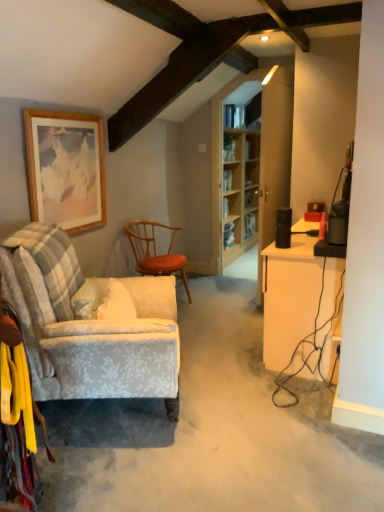
Question: Can you confirm if light blue fabric armchair at left, which ranks as the 1th chair in front-to-back order, is shorter than wooden textured chair at center, which appears as the second chair when viewed from the front?

Choices:
 (A) no
 (B) yes

Answer: (A)

Question: Does light blue fabric armchair at left, which ranks as the 1th chair in front-to-back order, lie in front of wooden textured chair at center, which appears as the second chair when viewed from the front?

Choices:
 (A) yes
 (B) no

Answer: (A)

Question: Is light blue fabric armchair at left, which ranks as the 1th chair in front-to-back order, thinner than wooden textured chair at center, which appears as the second chair when viewed from the front?

Choices:
 (A) no
 (B) yes

Answer: (A)

Question: Is wooden textured chair at center, the 1th chair when ordered from back to front, surrounded by light blue fabric armchair at left, which is the second chair in back-to-front order?

Choices:
 (A) no
 (B) yes

Answer: (A)

Question: From a real-world perspective, is light blue fabric armchair at left, which ranks as the 1th chair in front-to-back order, beneath wooden textured chair at center, which appears as the second chair when viewed from the front?

Choices:
 (A) no
 (B) yes

Answer: (A)

Question: Does point (160, 254) appear closer or farther from the camera than point (130, 290)?

Choices:
 (A) closer
 (B) farther

Answer: (B)

Question: Considering the positions of wooden textured chair at center, the 1th chair when ordered from back to front, and light blue fabric armchair at left, which ranks as the 1th chair in front-to-back order, in the image, is wooden textured chair at center, the 1th chair when ordered from back to front, bigger or smaller than light blue fabric armchair at left, which ranks as the 1th chair in front-to-back order,?

Choices:
 (A) small
 (B) big

Answer: (A)

Question: Is wooden textured chair at center, the 1th chair when ordered from back to front, taller or shorter than light blue fabric armchair at left, which is the second chair in back-to-front order?

Choices:
 (A) short
 (B) tall

Answer: (A)

Question: Considering the positions of wooden textured chair at center, the 1th chair when ordered from back to front, and light blue fabric armchair at left, which ranks as the 1th chair in front-to-back order, in the image, is wooden textured chair at center, the 1th chair when ordered from back to front, wider or thinner than light blue fabric armchair at left, which ranks as the 1th chair in front-to-back order,?

Choices:
 (A) wide
 (B) thin

Answer: (B)

Question: Is wooden textured chair at center, which appears as the second chair when viewed from the front, in front of or behind clear glass shelves at center in the image?

Choices:
 (A) behind
 (B) front

Answer: (B)

Question: In terms of width, does wooden textured chair at center, the 1th chair when ordered from back to front, look wider or thinner when compared to clear glass shelves at center?

Choices:
 (A) wide
 (B) thin

Answer: (A)

Question: Considering the positions of point (x=132, y=251) and point (x=226, y=159), is point (x=132, y=251) closer or farther from the camera than point (x=226, y=159)?

Choices:
 (A) farther
 (B) closer

Answer: (B)

Question: Considering the positions of wooden textured chair at center, the 1th chair when ordered from back to front, and clear glass shelves at center in the image, is wooden textured chair at center, the 1th chair when ordered from back to front, taller or shorter than clear glass shelves at center?

Choices:
 (A) tall
 (B) short

Answer: (A)

Question: Does point (228, 137) appear closer or farther from the camera than point (334, 274)?

Choices:
 (A) farther
 (B) closer

Answer: (A)

Question: Is clear glass shelves at center inside the boundaries of white glossy desk at right, or outside?

Choices:
 (A) outside
 (B) inside

Answer: (A)